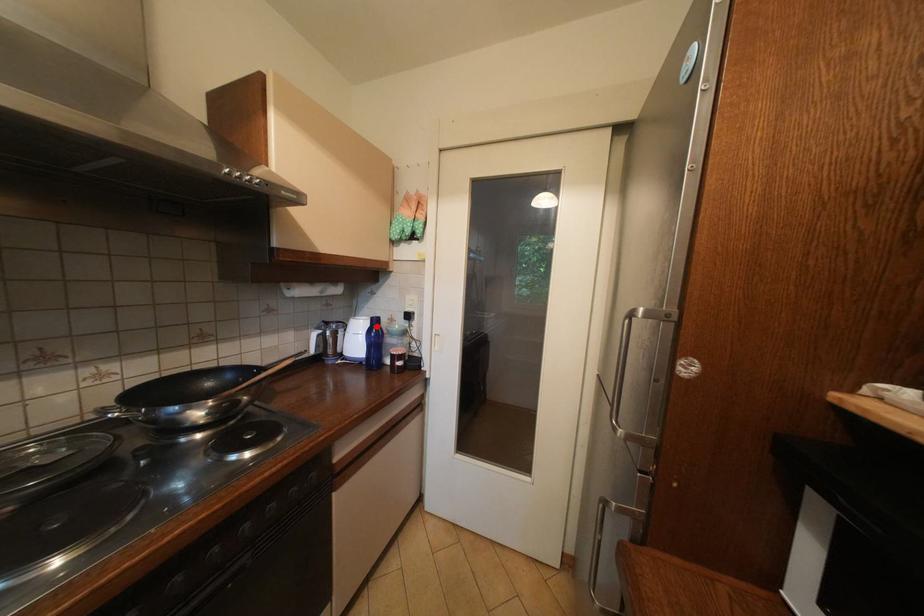
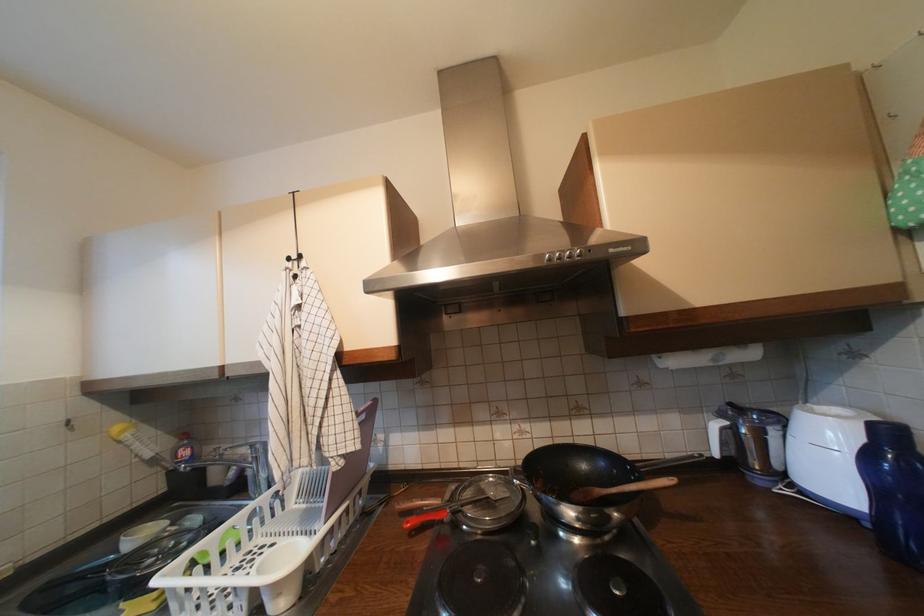
In the second image, find the point that corresponds to the highlighted location in the first image.

(870, 440)